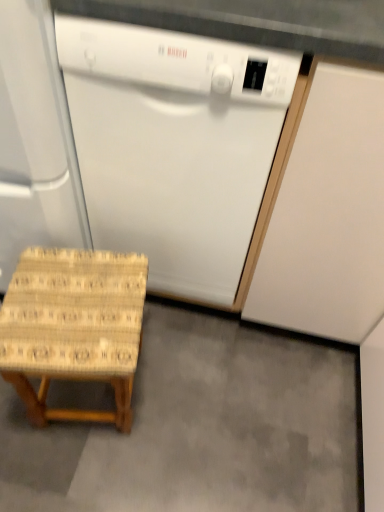
You are a GUI agent. You are given a task and a screenshot of the screen. Output one action in this format:
    pyautogui.click(x=<x>, y=<y>)
    Task: Click on the free spot above woven wood stool at lower left (from a real-world perspective)
    
    Given the screenshot: What is the action you would take?
    pyautogui.click(x=76, y=307)